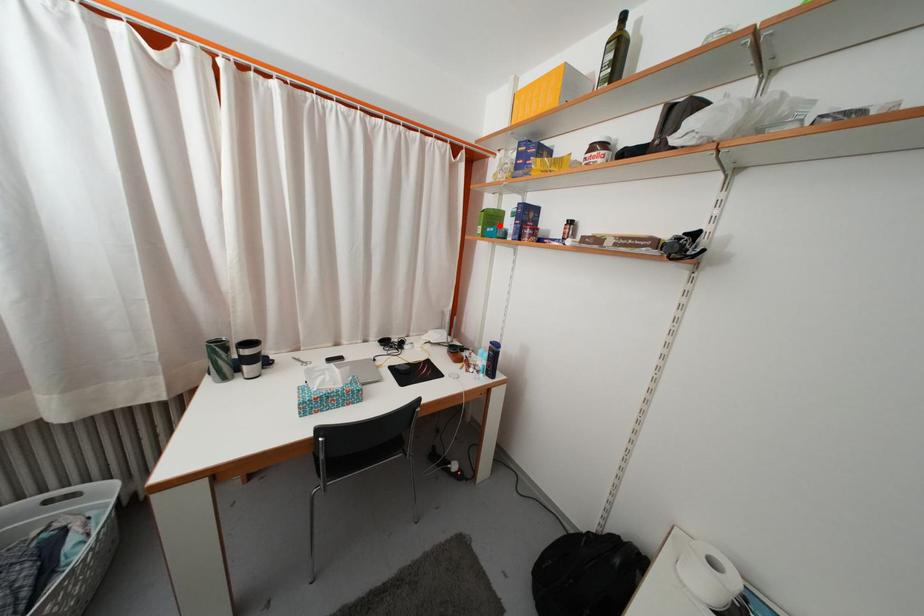
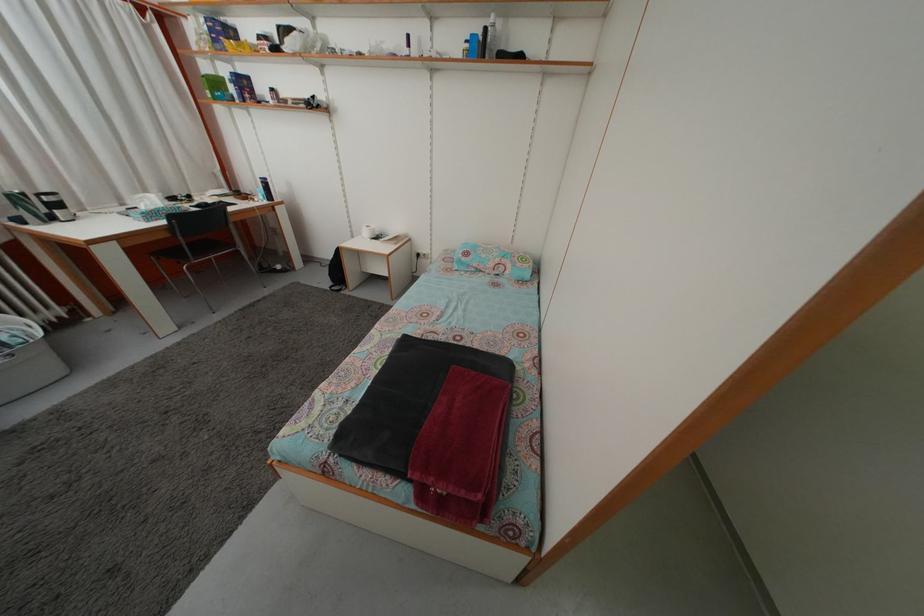
Question: I am providing you with two images of the same scene from different viewpoints. Given a red point in image1, look at the same physical point in image2. Is it:

Choices:
 (A) Closer to the viewpoint
 (B) Farther from the viewpoint

Answer: (B)